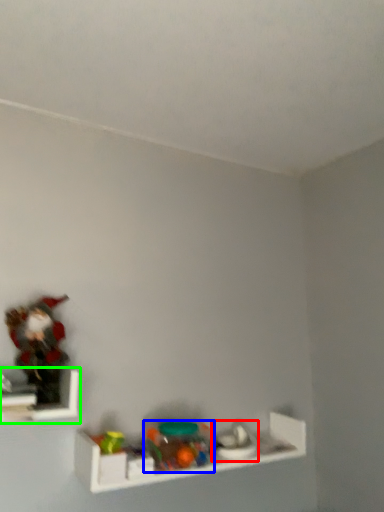
Question: Considering the real-world distances, which object is closest to toy (highlighted by a red box)? toy (highlighted by a blue box) or shelf (highlighted by a green box).

Choices:
 (A) toy
 (B) shelf

Answer: (A)